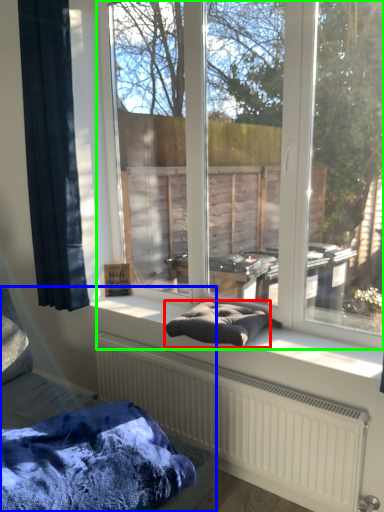
Question: Based on their relative distances, which object is nearer to material (highlighted by a red box)? Choose from furniture (highlighted by a blue box) and window (highlighted by a green box).

Choices:
 (A) furniture
 (B) window

Answer: (A)